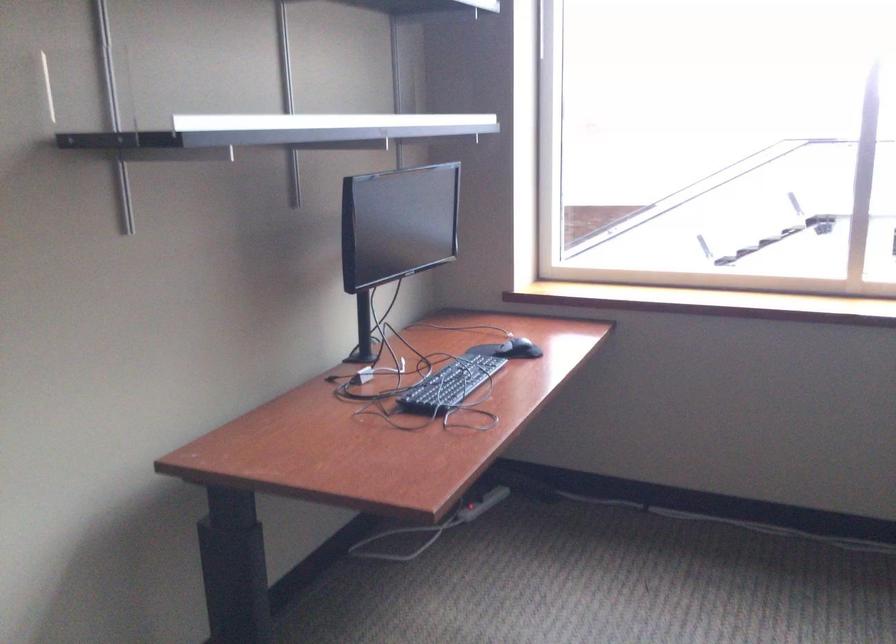
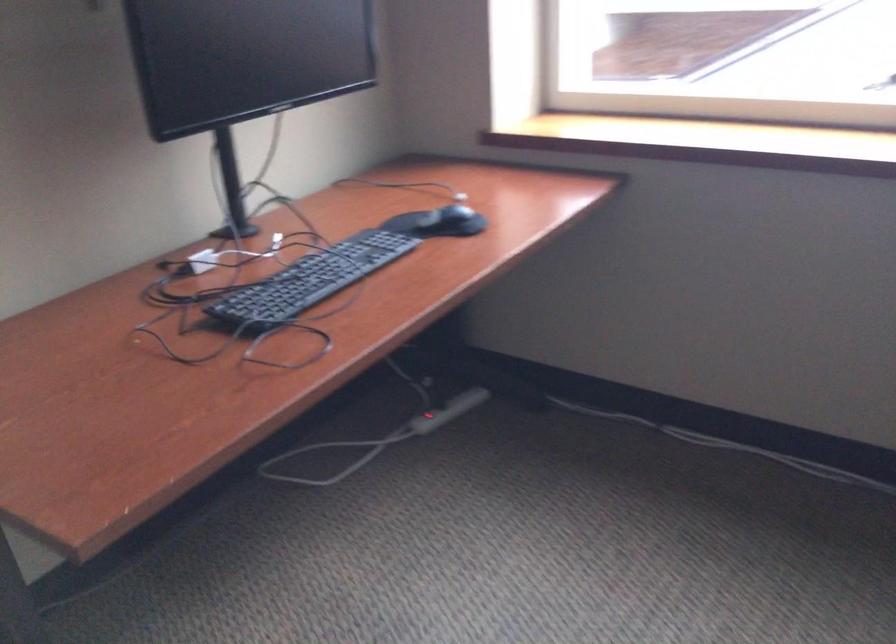
Where in the second image is the point corresponding to (436,527) from the first image?

(378, 439)